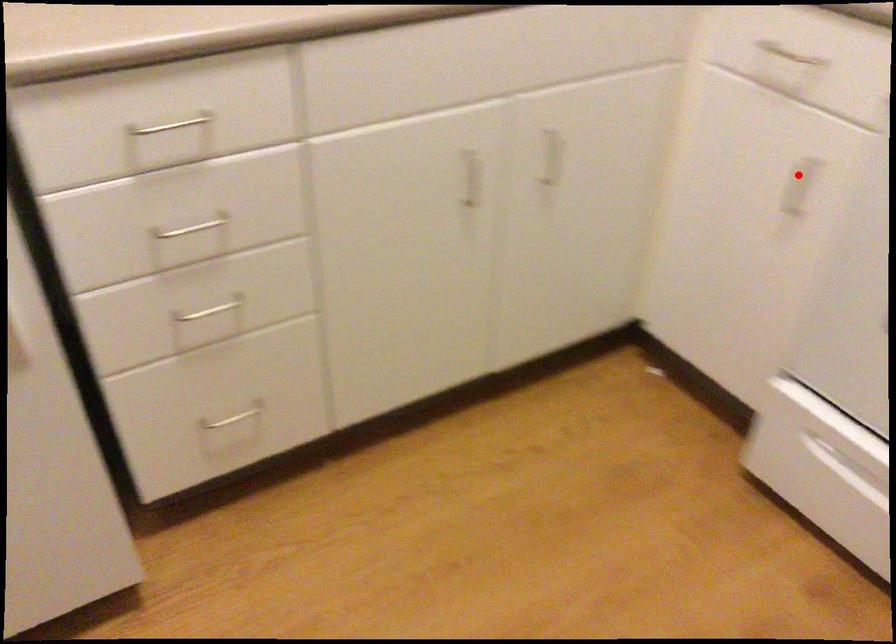
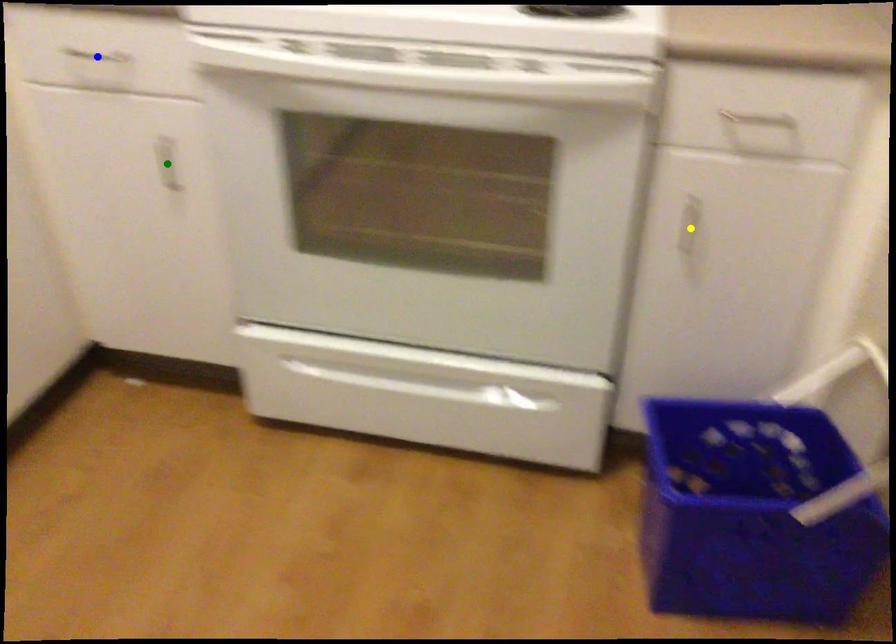
Question: I am providing you with two images of the same scene from different viewpoints. A red point is marked on the first image. You are given multiple points on the second image. Which point in image 2 represents the same 3d spot as the red point in image 1?

Choices:
 (A) yellow point
 (B) blue point
 (C) green point

Answer: (C)